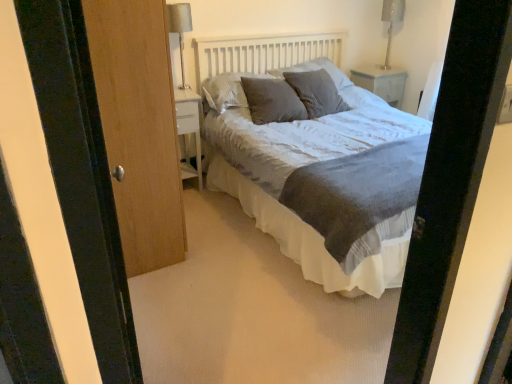
Question: Considering the relative sizes of silver metallic table lamp at upper left, which ranks as the 1th table lamp in front-to-back order, and textured gray pillow at center, the 2th pillow positioned from the left, in the image provided, is silver metallic table lamp at upper left, which ranks as the 1th table lamp in front-to-back order, smaller than textured gray pillow at center, the 2th pillow positioned from the left,?

Choices:
 (A) yes
 (B) no

Answer: (A)

Question: Is silver metallic table lamp at upper left, which is counted as the 2th table lamp, starting from the back, bigger than textured gray pillow at center, positioned as the third pillow in right-to-left order?

Choices:
 (A) no
 (B) yes

Answer: (A)

Question: From a real-world perspective, is silver metallic table lamp at upper left, which is counted as the second table lamp, starting from the right, over textured gray pillow at center, the 2th pillow positioned from the left?

Choices:
 (A) no
 (B) yes

Answer: (B)

Question: Does silver metallic table lamp at upper left, which is counted as the second table lamp, starting from the right, turn towards textured gray pillow at center, the 2th pillow positioned from the left?

Choices:
 (A) no
 (B) yes

Answer: (A)

Question: Is silver metallic table lamp at upper left, which ranks as the 1th table lamp in front-to-back order, oriented away from textured gray pillow at center, positioned as the third pillow in right-to-left order?

Choices:
 (A) yes
 (B) no

Answer: (B)

Question: Is silver metallic table lamp at upper left, which is counted as the second table lamp, starting from the right, in contact with textured gray pillow at center, the 2th pillow positioned from the left?

Choices:
 (A) yes
 (B) no

Answer: (B)

Question: Could you tell me if metallic silver table lamp at upper right, the second table lamp viewed from the left, is turned towards white glossy nightstand at upper right, the first nightstand in the right-to-left sequence?

Choices:
 (A) yes
 (B) no

Answer: (B)

Question: Is metallic silver table lamp at upper right, which appears as the second table lamp when viewed from the front, further to camera compared to white glossy nightstand at upper right, the 2th nightstand from the left?

Choices:
 (A) yes
 (B) no

Answer: (B)

Question: Is metallic silver table lamp at upper right, which is the first table lamp in right-to-left order, turned away from white glossy nightstand at upper right, the 2th nightstand from the left?

Choices:
 (A) no
 (B) yes

Answer: (A)

Question: Is metallic silver table lamp at upper right, the second table lamp viewed from the left, thinner than white glossy nightstand at upper right, the 2th nightstand from the left?

Choices:
 (A) no
 (B) yes

Answer: (B)

Question: Is white glossy nightstand at upper right, the first nightstand in the right-to-left sequence, completely or partially inside metallic silver table lamp at upper right, which appears as the second table lamp when viewed from the front?

Choices:
 (A) no
 (B) yes

Answer: (A)

Question: Is metallic silver table lamp at upper right, which is the first table lamp in right-to-left order, outside of white glossy nightstand at upper right, which ranks as the first nightstand in top-to-bottom order?

Choices:
 (A) yes
 (B) no

Answer: (A)

Question: Considering the relative sizes of textured gray pillow at center, positioned as the third pillow in right-to-left order, and textured gray bed at center in the image provided, is textured gray pillow at center, positioned as the third pillow in right-to-left order, taller than textured gray bed at center?

Choices:
 (A) yes
 (B) no

Answer: (B)